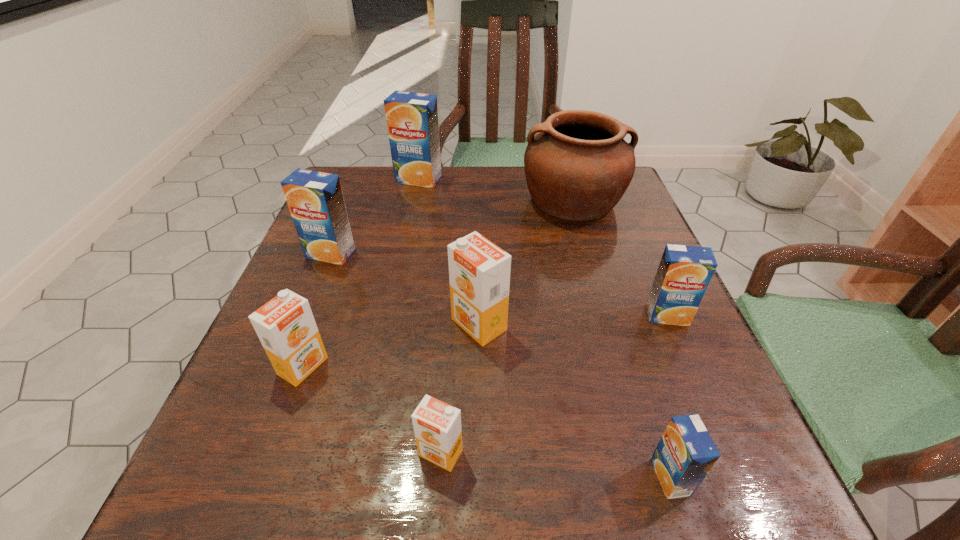
The height and width of the screenshot is (540, 960). Identify the location of orange_juice that is at the far edge. (412, 118).

I want to click on pottery at the far edge, so click(578, 167).

Identify the location of pottery present at the right edge. (578, 167).

Locate an element on the screen. The image size is (960, 540). object at the far left corner is located at coordinates (412, 118).

Identify the location of object situated at the far right corner. This screenshot has height=540, width=960. (578, 167).

Locate an element on the screen. Image resolution: width=960 pixels, height=540 pixels. object that is positioned at the near right corner is located at coordinates (685, 454).

The image size is (960, 540). In the image, there is a desktop. Find the location of `vacant space at the far edge`. vacant space at the far edge is located at coordinates (477, 191).

Where is `vacant space at the near edge`? This screenshot has height=540, width=960. vacant space at the near edge is located at coordinates (513, 491).

Identify the location of vacant space at the left edge of the desktop. The image size is (960, 540). (367, 222).

You are a GUI agent. You are given a task and a screenshot of the screen. Output one action in this format:
    pyautogui.click(x=<x>, y=<y>)
    Task: Click on the vacant space at the right edge of the desktop
    The width and height of the screenshot is (960, 540).
    Given the screenshot: What is the action you would take?
    pyautogui.click(x=608, y=268)